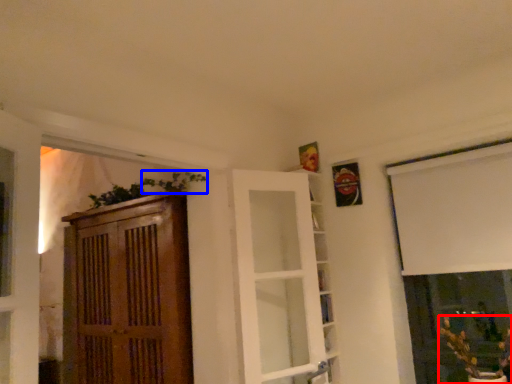
Question: Which object is further to the camera taking this photo, houseplant (highlighted by a red box) or plant (highlighted by a blue box)?

Choices:
 (A) houseplant
 (B) plant

Answer: (B)